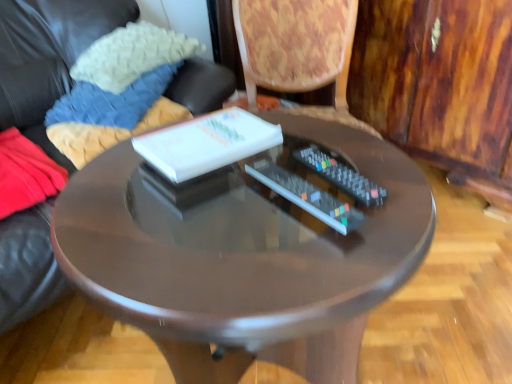
The width and height of the screenshot is (512, 384). Find the location of `vacant space in front of black plastic remote at center, which appears as the first remote control when viewed from the right`. vacant space in front of black plastic remote at center, which appears as the first remote control when viewed from the right is located at coordinates (342, 251).